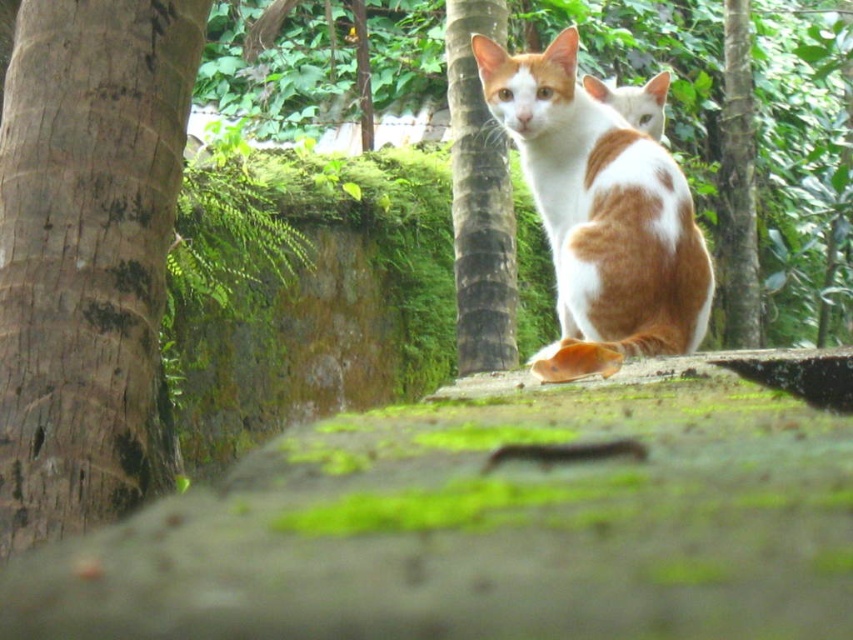
You are a bird trying to find a nesting spot. You see the brown textured bark at left and the green mossy tree trunk at center. Which tree would you choose if you want to build a nest higher up?

The green mossy tree trunk at center is taller than the brown textured bark at left, so you should choose the green mossy tree trunk at center to build a nest higher up.

You are a hiker trying to identify landmarks in the forest. You see a brown textured bark at left and a green mossy tree trunk at center. Which one is positioned more to the left side of the image?

The brown textured bark at left is positioned more to the left side of the image than the green mossy tree trunk at center.